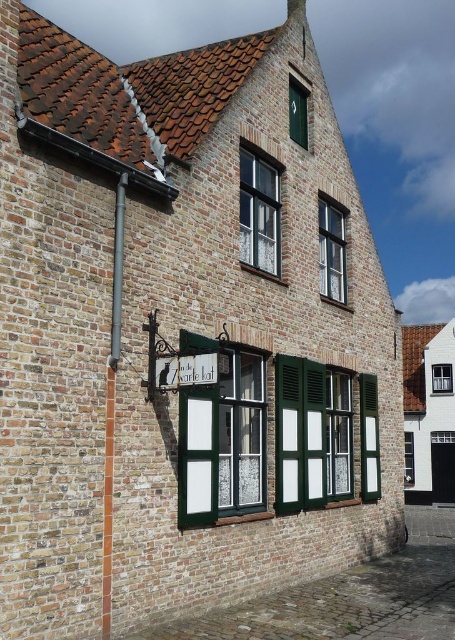
Is the position of green matte shutter at lower center more distant than that of clear glass window at center?

No, it is in front of clear glass window at center.

Where is `green matte shutter at lower center`? The height and width of the screenshot is (640, 455). green matte shutter at lower center is located at coordinates (369, 438).

Can you confirm if white lace curtain at upper center is positioned to the right of clear glass window at upper center?

In fact, white lace curtain at upper center is to the left of clear glass window at upper center.

Is point (241, 218) closer to viewer compared to point (324, 198)?

That is True.

Identify the location of white lace curtain at upper center. The height and width of the screenshot is (640, 455). (258, 212).

Based on the photo, who is higher up, clear glass window at upper center or clear glass window at center?

Positioned higher is clear glass window at upper center.

Between clear glass window at upper center and clear glass window at center, which one appears on the left side from the viewer's perspective?

From the viewer's perspective, clear glass window at upper center appears more on the left side.

Is point (328, 259) more distant than point (410, 477)?

No, (328, 259) is closer to viewer.

Identify the location of clear glass window at upper center. (332, 252).